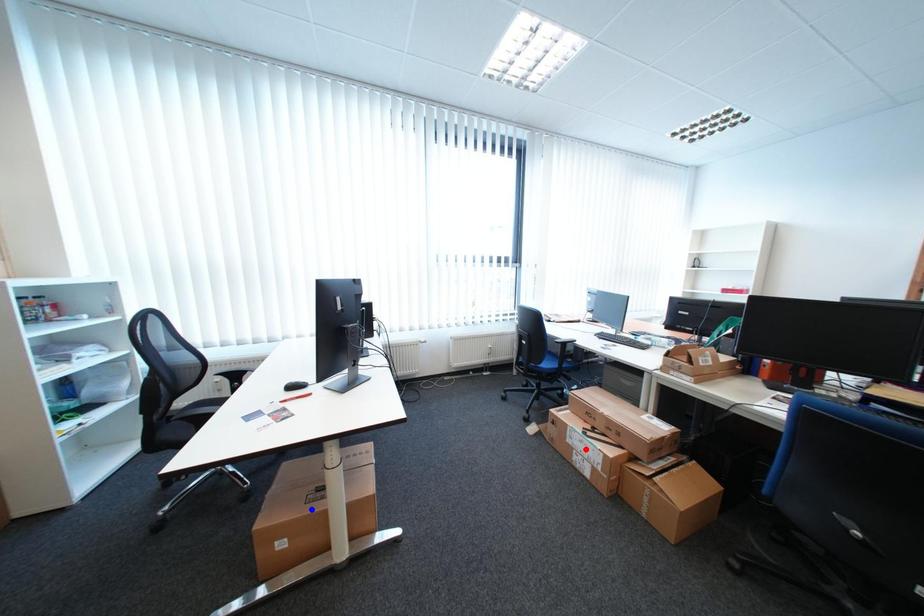
Question: Two points are marked on the image. Which point is closer to the camera?

Choices:
 (A) Blue point is closer.
 (B) Red point is closer.

Answer: (A)